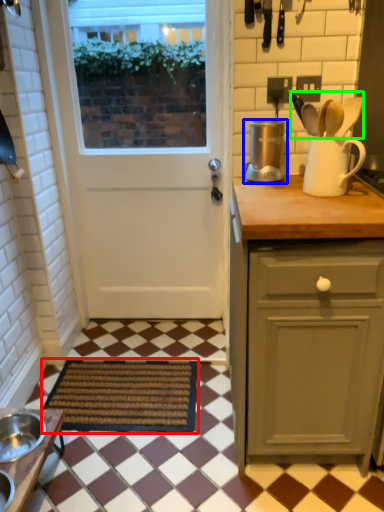
Question: Which is farther away from mat (highlighted by a red box)? kitchen appliance (highlighted by a blue box) or silverware (highlighted by a green box)?

Choices:
 (A) kitchen appliance
 (B) silverware

Answer: (B)